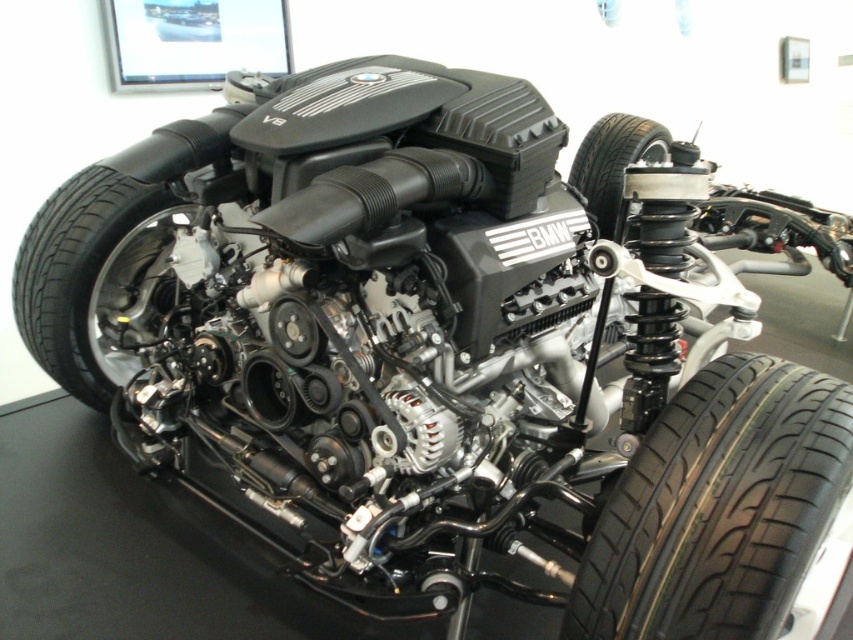
From the picture: Which is below, black rubber tire at lower right or black rubber tire at center?

Positioned lower is black rubber tire at lower right.

Between point (714, 472) and point (624, 124), which one is positioned behind?

The point (624, 124) is more distant.

Does point (714, 524) lie in front of point (613, 216)?

Yes, point (714, 524) is closer to viewer.

Where is `black rubber tire at lower right`? The width and height of the screenshot is (853, 640). black rubber tire at lower right is located at coordinates (718, 508).

Can you confirm if black rubber tire at lower right is smaller than black rubber tire at lower left?

Yes.

Which of these two, black rubber tire at lower right or black rubber tire at lower left, stands shorter?

Standing shorter between the two is black rubber tire at lower right.

Which is behind, point (699, 464) or point (61, 372)?

The point (61, 372) is behind.

The height and width of the screenshot is (640, 853). I want to click on black rubber tire at lower right, so click(718, 508).

Is black rubber tire at lower left bigger than black rubber tire at center?

Yes.

Identify the location of black rubber tire at lower left. This screenshot has width=853, height=640. (96, 280).

Identify the location of black rubber tire at lower left. The height and width of the screenshot is (640, 853). (96, 280).